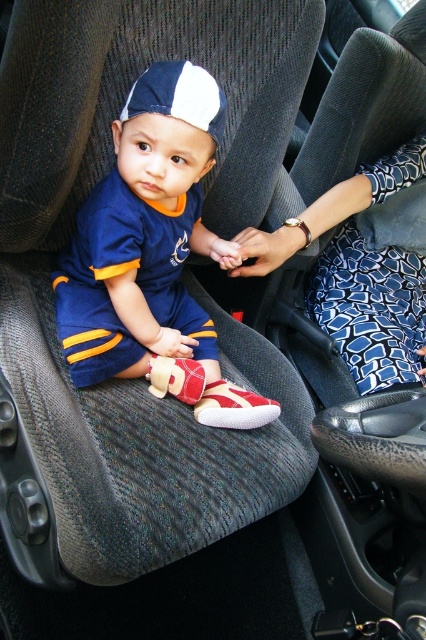
Which is above, blue printed fabric at center or white and navy blue fabric baseball cap at center?

white and navy blue fabric baseball cap at center

Who is positioned more to the right, blue printed fabric at center or white and navy blue fabric baseball cap at center?

From the viewer's perspective, blue printed fabric at center appears more on the right side.

Who is more distant from viewer, [412,376] or [181,93]?

Positioned behind is point [412,376].

The image size is (426, 640). I want to click on blue printed fabric at center, so click(x=357, y=273).

Which is more to the left, matte blue jersey at center or white and navy blue fabric baseball cap at center?

Positioned to the left is matte blue jersey at center.

Between matte blue jersey at center and white and navy blue fabric baseball cap at center, which one is positioned lower?

matte blue jersey at center is lower down.

Is point (77, 324) farther from viewer compared to point (141, 74)?

No, (77, 324) is in front of (141, 74).

Find the location of a particular element. The image size is (426, 640). matte blue jersey at center is located at coordinates (152, 252).

Is matte blue jersey at center to the left of blue printed fabric at center from the viewer's perspective?

Correct, you'll find matte blue jersey at center to the left of blue printed fabric at center.

Is matte blue jersey at center above blue printed fabric at center?

No, matte blue jersey at center is not above blue printed fabric at center.

Describe the element at coordinates (152, 252) in the screenshot. Image resolution: width=426 pixels, height=640 pixels. I see `matte blue jersey at center` at that location.

Where is `matte blue jersey at center`? matte blue jersey at center is located at coordinates (152, 252).